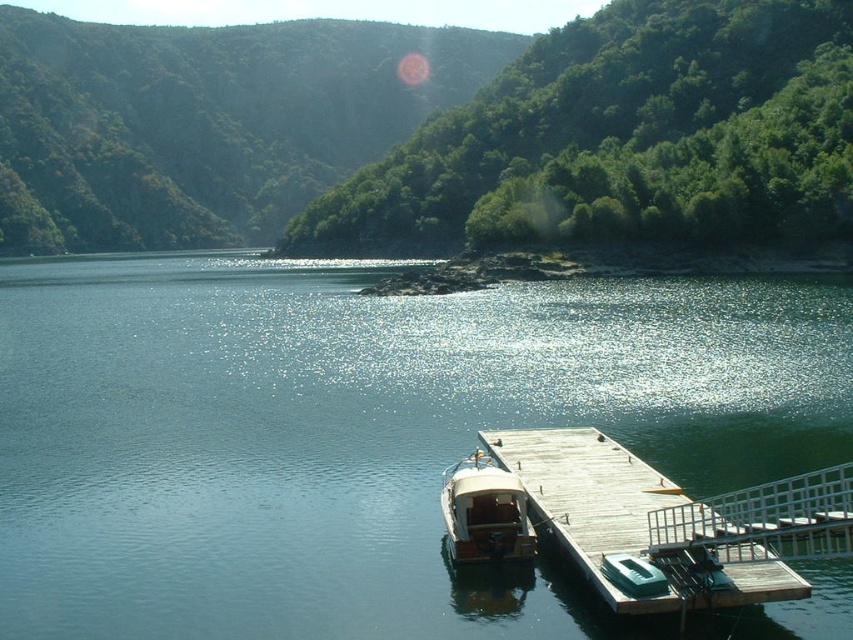
Question: Estimate the real-world distances between objects in this image. Which object is farther from the wooden dock at lower right?

Choices:
 (A) wooden polished boat at center
 (B) clear blue water at center

Answer: (B)

Question: Can you confirm if clear blue water at center is positioned to the right of wooden dock at lower right?

Choices:
 (A) yes
 (B) no

Answer: (B)

Question: Observing the image, what is the correct spatial positioning of clear blue water at center in reference to wooden polished boat at center?

Choices:
 (A) right
 (B) left

Answer: (B)

Question: Which object is the closest to the clear blue water at center?

Choices:
 (A) wooden dock at lower right
 (B) wooden polished boat at center

Answer: (A)

Question: Which of the following is the farthest from the observer?

Choices:
 (A) (460, 547)
 (B) (32, 550)
 (C) (631, 490)

Answer: (C)

Question: Can you confirm if clear blue water at center is positioned below wooden dock at lower right?

Choices:
 (A) no
 (B) yes

Answer: (A)